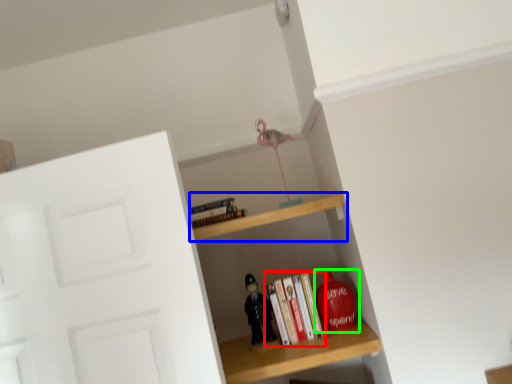
Question: Which is nearer to the book (highlighted by a red box)? shelf (highlighted by a blue box) or toy (highlighted by a green box).

Choices:
 (A) shelf
 (B) toy

Answer: (B)